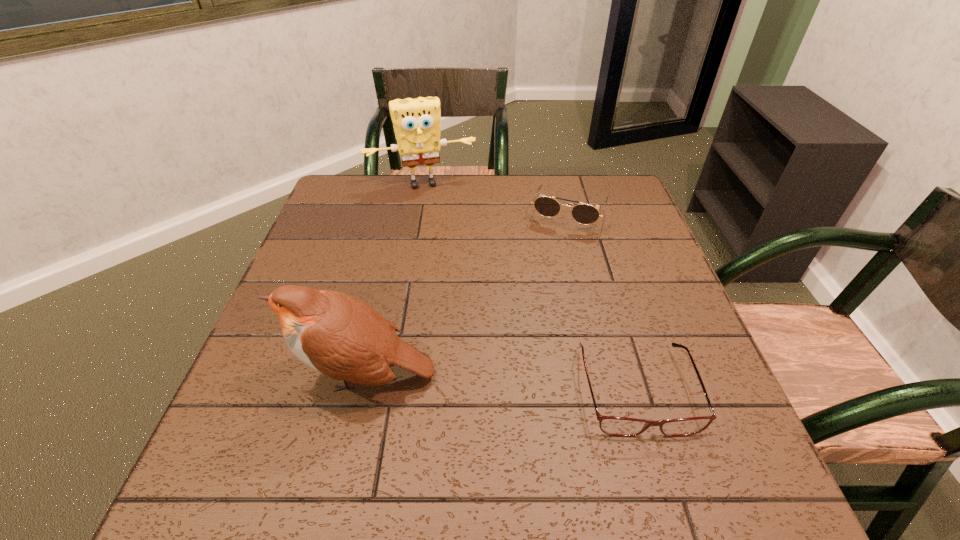
At what (x,y) coordinates should I click in order to perform the action: click on vacant region between the sponge and the second shortest object. Please return your answer as a coordinate pair (x, y). Looking at the image, I should click on (495, 198).

In order to click on vacant space that is in between the spectacles and the sponge in this screenshot , I will do pyautogui.click(x=529, y=287).

Locate an element on the screen. vacant region between the bird and the spectacles is located at coordinates (500, 382).

At what (x,y) coordinates should I click in order to perform the action: click on vacant area that lies between the shortest object and the sponge. Please return your answer as a coordinate pair (x, y). Image resolution: width=960 pixels, height=540 pixels. Looking at the image, I should click on (529, 287).

Locate an element on the screen. The height and width of the screenshot is (540, 960). free space between the sponge and the bird is located at coordinates (394, 280).

You are a GUI agent. You are given a task and a screenshot of the screen. Output one action in this format:
    pyautogui.click(x=<x>, y=<y>)
    Task: Click on the vacant region between the bird and the sunglasses
    This screenshot has width=960, height=540.
    Given the screenshot: What is the action you would take?
    pyautogui.click(x=467, y=294)

Locate an element on the screen. free space between the sunglasses and the sponge is located at coordinates (495, 198).

At what (x,y) coordinates should I click in order to perform the action: click on free space that is in between the spectacles and the sunglasses. Please return your answer as a coordinate pair (x, y). Looking at the image, I should click on (603, 301).

You are a GUI agent. You are given a task and a screenshot of the screen. Output one action in this format:
    pyautogui.click(x=<x>, y=<y>)
    Task: Click on the empty space that is in between the sponge and the second shortest object
    This screenshot has height=540, width=960.
    Given the screenshot: What is the action you would take?
    pyautogui.click(x=495, y=198)

The width and height of the screenshot is (960, 540). I want to click on object that stands as the closest to the sponge, so click(585, 214).